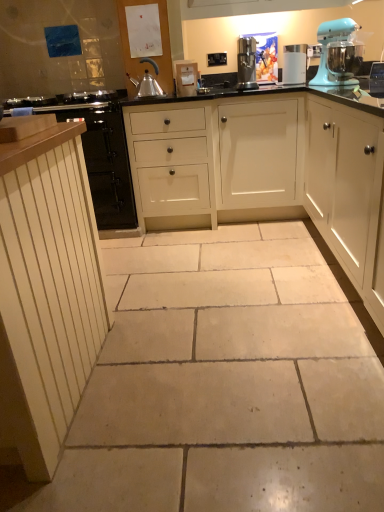
What do you see at coordinates (47, 292) in the screenshot?
I see `white wood cabinet at left, which ranks as the second cabinetry in left-to-right order` at bounding box center [47, 292].

Measure the distance between point (337, 85) and camera.

Point (337, 85) and camera are 2.55 meters apart from each other.

This screenshot has width=384, height=512. In order to click on white matte cabinet at right, the first cabinetry when ordered from right to left in this screenshot , I will do `click(348, 193)`.

This screenshot has height=512, width=384. Identify the location of white wood cabinets at center, the second cabinetry positioned from the right. (267, 172).

Where is `beige stone floor at center`? beige stone floor at center is located at coordinates (225, 383).

From the image's perspective, which is above, white matte cabinet at right, which ranks as the 4th cabinetry in left-to-right order, or beige stone floor at center?

From the image's view, white matte cabinet at right, which ranks as the 4th cabinetry in left-to-right order, is above.

From a real-world perspective, which is physically above, white matte cabinet at right, which ranks as the 4th cabinetry in left-to-right order, or beige stone floor at center?

white matte cabinet at right, which ranks as the 4th cabinetry in left-to-right order, from a real-world perspective.

Between white matte cabinet at right, the first cabinetry when ordered from right to left, and beige stone floor at center, which one has larger size?

With larger size is white matte cabinet at right, the first cabinetry when ordered from right to left.

Can you tell me how much white matte cabinet at right, the first cabinetry when ordered from right to left, and beige stone floor at center differ in facing direction?

89.2 degrees separate the facing orientations of white matte cabinet at right, the first cabinetry when ordered from right to left, and beige stone floor at center.

From the image's perspective, does white wood cabinet at left, positioned as the third cabinetry in right-to-left order, appear lower than beige stone floor at center?

No, from the image's perspective, white wood cabinet at left, positioned as the third cabinetry in right-to-left order, is not below beige stone floor at center.

Would you say white wood cabinet at left, positioned as the third cabinetry in right-to-left order, is inside or outside beige stone floor at center?

white wood cabinet at left, positioned as the third cabinetry in right-to-left order, lies outside beige stone floor at center.

Which object is further away from the camera, white wood cabinet at left, positioned as the third cabinetry in right-to-left order, or beige stone floor at center?

Positioned behind is beige stone floor at center.

What's the angular difference between white wood cabinet at left, which ranks as the second cabinetry in left-to-right order, and beige stone floor at center's facing directions?

They differ by 0.593 degrees in their facing directions.

Is satin silver coffee maker at upper center, the first kitchen appliance when ordered from left to right, further to camera compared to white wood cabinet at left, which ranks as the second cabinetry in left-to-right order?

Yes, satin silver coffee maker at upper center, the first kitchen appliance when ordered from left to right, is further from the camera.

Looking at this image, visually, is satin silver coffee maker at upper center, placed as the second kitchen appliance when sorted from right to left, positioned to the left or to the right of white wood cabinet at left, positioned as the third cabinetry in right-to-left order?

satin silver coffee maker at upper center, placed as the second kitchen appliance when sorted from right to left, is to the right of white wood cabinet at left, positioned as the third cabinetry in right-to-left order.

From a real-world perspective, is satin silver coffee maker at upper center, placed as the second kitchen appliance when sorted from right to left, above or below white wood cabinet at left, positioned as the third cabinetry in right-to-left order?

In terms of real-world spatial position, satin silver coffee maker at upper center, placed as the second kitchen appliance when sorted from right to left, is above white wood cabinet at left, positioned as the third cabinetry in right-to-left order.

Is satin silver coffee maker at upper center, placed as the second kitchen appliance when sorted from right to left, looking in the opposite direction of white wood cabinets at center, the second cabinetry positioned from the right?

No, satin silver coffee maker at upper center, placed as the second kitchen appliance when sorted from right to left,'s orientation is not away from white wood cabinets at center, the second cabinetry positioned from the right.

Is satin silver coffee maker at upper center, placed as the second kitchen appliance when sorted from right to left, not inside white wood cabinets at center, positioned as the 3th cabinetry in left-to-right order?

No.

Is the depth of satin silver coffee maker at upper center, placed as the second kitchen appliance when sorted from right to left, greater than that of white wood cabinets at center, positioned as the 3th cabinetry in left-to-right order?

No, satin silver coffee maker at upper center, placed as the second kitchen appliance when sorted from right to left, is closer to the viewer.

Is light blue plastic stand mixer at upper right turned away from white wood cabinet at left, which is counted as the first cabinetry, starting from the left?

No, light blue plastic stand mixer at upper right is not facing away from white wood cabinet at left, which is counted as the first cabinetry, starting from the left.

Between light blue plastic stand mixer at upper right and white wood cabinet at left, which is counted as the first cabinetry, starting from the left, which one has larger size?

white wood cabinet at left, which is counted as the first cabinetry, starting from the left, is bigger.

Considering the sizes of light blue plastic stand mixer at upper right and white wood cabinet at left, which is counted as the first cabinetry, starting from the left, in the image, is light blue plastic stand mixer at upper right taller or shorter than white wood cabinet at left, which is counted as the first cabinetry, starting from the left,?

In the image, light blue plastic stand mixer at upper right appears to be shorter than white wood cabinet at left, which is counted as the first cabinetry, starting from the left.

What's the angular difference between light blue plastic stand mixer at upper right and white wood cabinet at left, which is counted as the first cabinetry, starting from the left,'s facing directions?

There is a 24-degree angle between the facing directions of light blue plastic stand mixer at upper right and white wood cabinet at left, which is counted as the first cabinetry, starting from the left.

Can we say white matte cabinet at right, the first cabinetry when ordered from right to left, lies outside light blue plastic stand mixer at upper right?

white matte cabinet at right, the first cabinetry when ordered from right to left, is positioned outside light blue plastic stand mixer at upper right.

Is there a large distance between white matte cabinet at right, which ranks as the 4th cabinetry in left-to-right order, and light blue plastic stand mixer at upper right?

No.

Is white matte cabinet at right, the first cabinetry when ordered from right to left, closer to camera compared to light blue plastic stand mixer at upper right?

Yes, white matte cabinet at right, the first cabinetry when ordered from right to left, is in front of light blue plastic stand mixer at upper right.

From a real-world perspective, is white matte cabinet at right, which ranks as the 4th cabinetry in left-to-right order, above or below light blue plastic stand mixer at upper right?

From a real-world perspective, white matte cabinet at right, which ranks as the 4th cabinetry in left-to-right order, is physically below light blue plastic stand mixer at upper right.

Can you tell me how much white wood cabinet at left, the fourth cabinetry viewed from the right, and white wood cabinet at left, which ranks as the second cabinetry in left-to-right order, differ in facing direction?

There is a 0.174-degree angle between the facing directions of white wood cabinet at left, the fourth cabinetry viewed from the right, and white wood cabinet at left, which ranks as the second cabinetry in left-to-right order.

Between point (111, 129) and point (67, 173), which one is positioned in front?

Positioned in front is point (67, 173).

From the picture: Between white wood cabinet at left, which is counted as the first cabinetry, starting from the left, and white wood cabinet at left, positioned as the third cabinetry in right-to-left order, which one appears on the left side from the viewer's perspective?

From the viewer's perspective, white wood cabinet at left, which is counted as the first cabinetry, starting from the left, appears more on the left side.

From the image's perspective, is white wood cabinet at left, which is counted as the first cabinetry, starting from the left, over white wood cabinet at left, positioned as the third cabinetry in right-to-left order?

Yes, from the image's perspective, white wood cabinet at left, which is counted as the first cabinetry, starting from the left, is over white wood cabinet at left, positioned as the third cabinetry in right-to-left order.

The height and width of the screenshot is (512, 384). What are the coordinates of `concrete below the white matte cabinet at right, which ranks as the 4th cabinetry in left-to-right order (from a real-world perspective)` in the screenshot? It's located at (225, 383).

Identify the location of the 2nd cabinetry in front of the beige stone floor at center. (47, 292).

Based on their spatial positions, is beige stone floor at center or white glossy water filter at upper center, the 1th kitchen appliance viewed from the right, closer to satin silver coffee maker at upper center, the first kitchen appliance when ordered from left to right?

white glossy water filter at upper center, the 1th kitchen appliance viewed from the right, lies closer to satin silver coffee maker at upper center, the first kitchen appliance when ordered from left to right, than the other object.

Looking at the image, which one is located closer to white wood cabinets at center, positioned as the 3th cabinetry in left-to-right order, satin silver coffee maker at upper center, placed as the second kitchen appliance when sorted from right to left, or beige stone floor at center?

satin silver coffee maker at upper center, placed as the second kitchen appliance when sorted from right to left, is positioned closer to the anchor white wood cabinets at center, positioned as the 3th cabinetry in left-to-right order.

Based on their spatial positions, is light blue plastic stand mixer at upper right or beige stone floor at center closer to white matte cabinet at right, which ranks as the 4th cabinetry in left-to-right order?

The object closer to white matte cabinet at right, which ranks as the 4th cabinetry in left-to-right order, is beige stone floor at center.

Consider the image. From the image, which object appears to be farther from white wood cabinet at left, positioned as the third cabinetry in right-to-left order, white glossy water filter at upper center, which appears as the second kitchen appliance when viewed from the left, or white wood cabinet at left, which is counted as the first cabinetry, starting from the left?

The object further to white wood cabinet at left, positioned as the third cabinetry in right-to-left order, is white glossy water filter at upper center, which appears as the second kitchen appliance when viewed from the left.

Looking at the image, which one is located closer to white glossy water filter at upper center, which appears as the second kitchen appliance when viewed from the left, white wood cabinets at center, the second cabinetry positioned from the right, or white matte cabinet at right, the first cabinetry when ordered from right to left?

white wood cabinets at center, the second cabinetry positioned from the right.

Looking at this image, from the image, which object appears to be farther from satin silver coffee maker at upper center, placed as the second kitchen appliance when sorted from right to left, white wood cabinet at left, the fourth cabinetry viewed from the right, or light blue plastic stand mixer at upper right?

white wood cabinet at left, the fourth cabinetry viewed from the right.

When comparing their distances from beige stone floor at center, does white wood cabinet at left, the fourth cabinetry viewed from the right, or light blue plastic stand mixer at upper right seem further?

light blue plastic stand mixer at upper right is positioned further to the anchor beige stone floor at center.

Which object lies further to the anchor point white wood cabinet at left, which ranks as the second cabinetry in left-to-right order, white matte cabinet at right, the first cabinetry when ordered from right to left, or white glossy water filter at upper center, the 1th kitchen appliance viewed from the right?

The object further to white wood cabinet at left, which ranks as the second cabinetry in left-to-right order, is white glossy water filter at upper center, the 1th kitchen appliance viewed from the right.

Where is `concrete positioned between white wood cabinet at left, positioned as the third cabinetry in right-to-left order, and satin silver coffee maker at upper center, the first kitchen appliance when ordered from left to right, from near to far`? concrete positioned between white wood cabinet at left, positioned as the third cabinetry in right-to-left order, and satin silver coffee maker at upper center, the first kitchen appliance when ordered from left to right, from near to far is located at coordinates (225, 383).

This screenshot has height=512, width=384. In order to click on concrete between white matte cabinet at right, which ranks as the 4th cabinetry in left-to-right order, and white glossy water filter at upper center, which appears as the second kitchen appliance when viewed from the left, from front to back in this screenshot , I will do `click(225, 383)`.

Find the location of a particular element. Image resolution: width=384 pixels, height=512 pixels. home appliance that lies between satin silver coffee maker at upper center, the first kitchen appliance when ordered from left to right, and white wood cabinets at center, the second cabinetry positioned from the right, from top to bottom is located at coordinates (338, 54).

Identify the location of concrete positioned between white wood cabinet at left, which ranks as the second cabinetry in left-to-right order, and white wood cabinets at center, positioned as the 3th cabinetry in left-to-right order, from near to far. This screenshot has width=384, height=512. tap(225, 383).